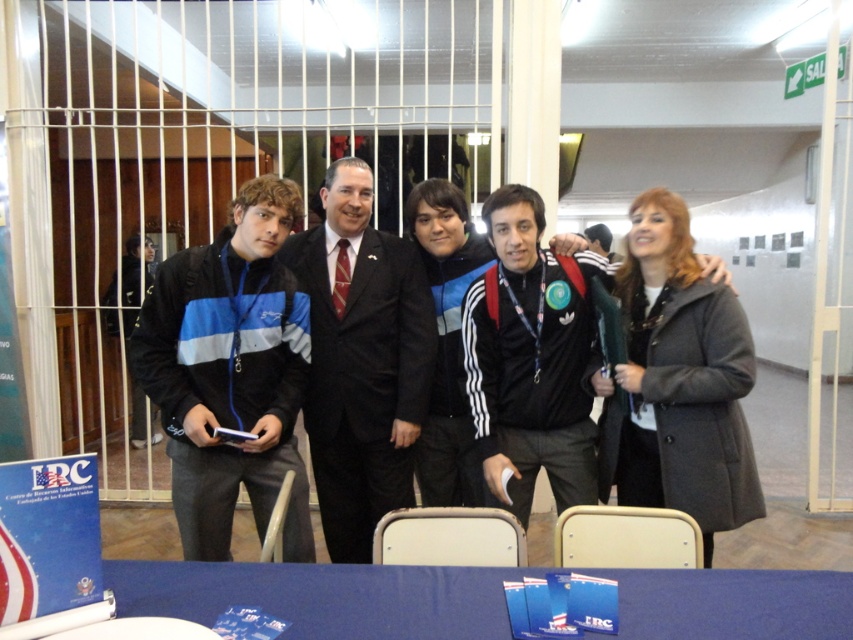
You are organizing a photo shoot and need to arrange the black fleece jacket at center and the black adidas jacket at center on a rack. Which jacket should you place on the higher shelf to match their actual sizes?

The black fleece jacket at center is taller than the black adidas jacket at center, so place the black fleece jacket at center on the higher shelf to reflect its greater height.

You are organizing a photo shoot and need to arrange the black suit at center and the black adidas jacket at center based on their sizes. Which one should you place in a position that requires more space?

The black suit at center has a larger size compared to the black adidas jacket at center, so you should place the black suit at center in the position that requires more space.

You are standing in front of the group photo and want to determine which of the two points, point 1 at coordinates point (352, 461) or point 2 at coordinates point (521, 442), is closer to you. Which point is nearer?

Point 1 at coordinates point (352, 461) is closer to you because it is further to the viewer than point 2 at coordinates point (521, 442).